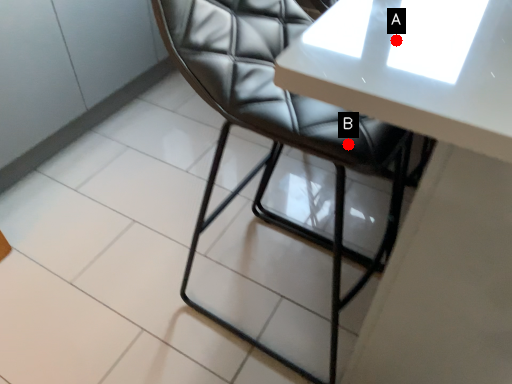
Question: Two points are circled on the image, labeled by A and B beside each circle. Which point is closer to the camera?

Choices:
 (A) A is closer
 (B) B is closer

Answer: (A)